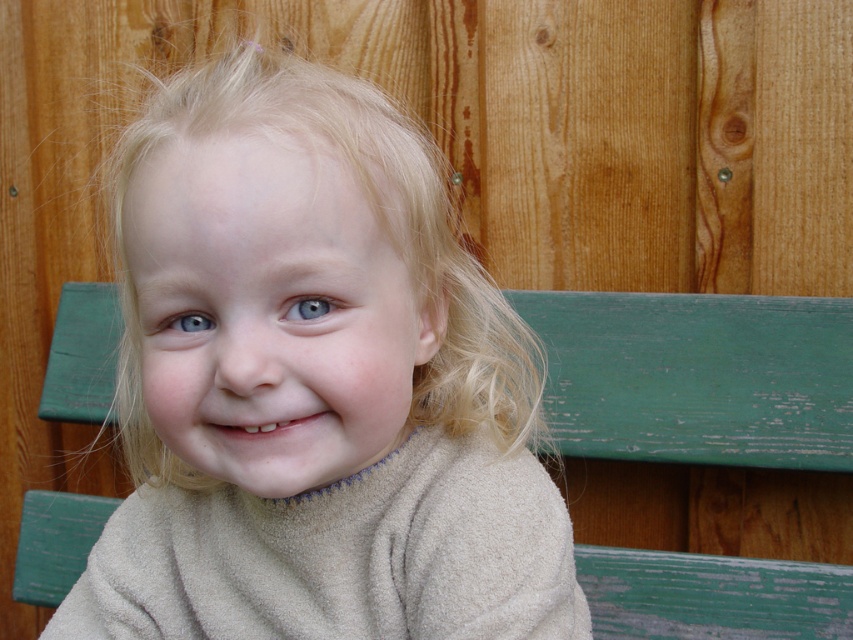
Can you confirm if beige fleece at center is bigger than green painted wood bench at center?

Correct, beige fleece at center is larger in size than green painted wood bench at center.

Describe the element at coordinates (312, 384) in the screenshot. This screenshot has height=640, width=853. I see `beige fleece at center` at that location.

I want to click on beige fleece at center, so click(x=312, y=384).